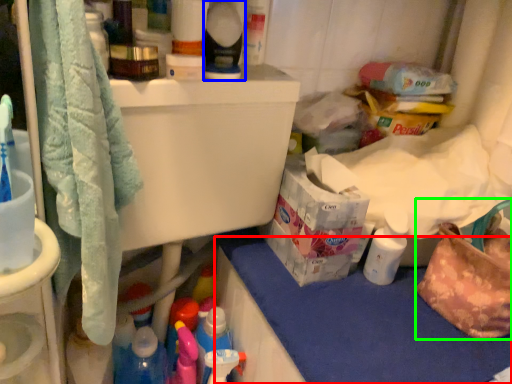
Question: Estimate the real-world distances between objects in this image. Which object is farther from counter top (highlighted by a red box), cleaning product (highlighted by a blue box) or handbag (highlighted by a green box)?

Choices:
 (A) cleaning product
 (B) handbag

Answer: (A)